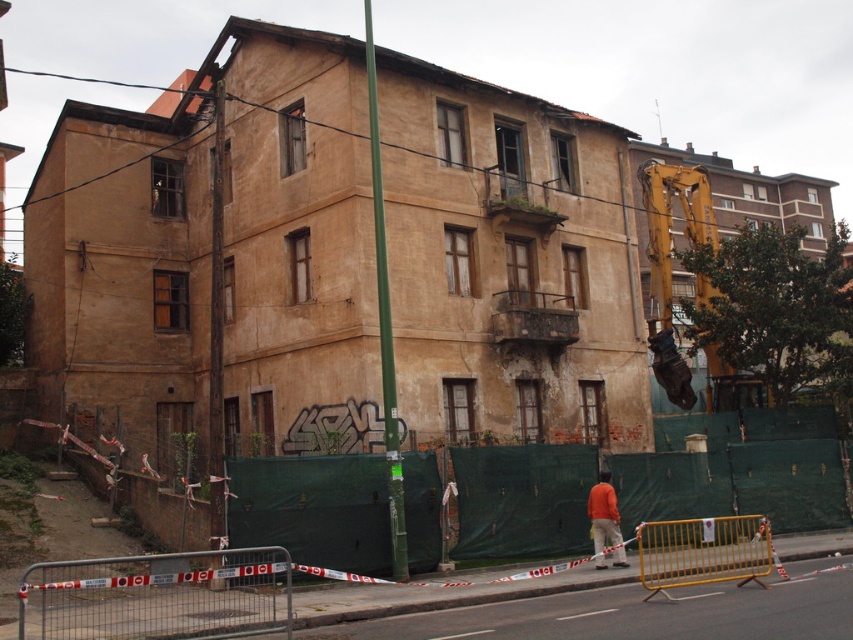
Who is more distant from viewer, (120,579) or (618,561)?

Positioned behind is point (618,561).

Who is higher up, metal barricade at lower left or orange fabric construction worker at lower center?

orange fabric construction worker at lower center

What do you see at coordinates (158, 595) in the screenshot? I see `metal barricade at lower left` at bounding box center [158, 595].

This screenshot has width=853, height=640. I want to click on metal barricade at lower left, so click(158, 595).

Between green metallic pole at center and orange fabric construction worker at lower center, which one appears on the left side from the viewer's perspective?

green metallic pole at center

Is point (393, 508) in front of point (596, 490)?

That is True.

Does point (381, 262) lie in front of point (604, 472)?

Yes, point (381, 262) is closer to viewer.

This screenshot has width=853, height=640. Identify the location of green metallic pole at center. (386, 324).

Is yellow metallic barricade at center positioned in front of orange fabric construction worker at lower center?

Yes, yellow metallic barricade at center is closer to the viewer.

Who is higher up, yellow metallic barricade at center or orange fabric construction worker at lower center?

Positioned higher is orange fabric construction worker at lower center.

Describe the element at coordinates (701, 552) in the screenshot. The height and width of the screenshot is (640, 853). I see `yellow metallic barricade at center` at that location.

Where is `yellow metallic barricade at center`? yellow metallic barricade at center is located at coordinates (701, 552).